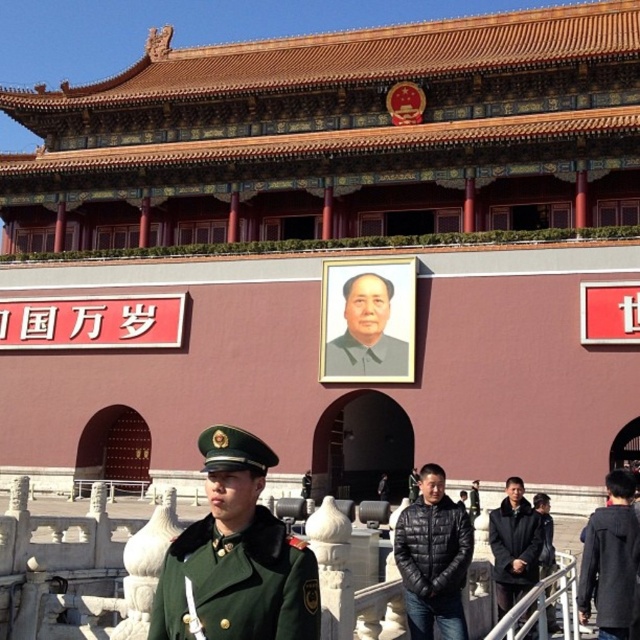
Question: Which object is farther from the camera taking this photo?

Choices:
 (A) green fabric uniform at center
 (B) green fabric uniform at lower right
 (C) black leather jacket at lower right
 (D) smooth gray portrait at center

Answer: (D)

Question: Does black leather jacket at lower right appear on the left side of green fabric uniform at center?

Choices:
 (A) no
 (B) yes

Answer: (A)

Question: Observing the image, what is the correct spatial positioning of green fabric uniform at lower right in reference to black leather jacket at lower right?

Choices:
 (A) above
 (B) below

Answer: (A)

Question: Estimate the real-world distances between objects in this image. Which object is closer to the green fabric uniform at lower right?

Choices:
 (A) green fabric uniform at center
 (B) green woolen coat at lower left
 (C) black leather jacket at lower right

Answer: (C)

Question: Which object is farther from the camera taking this photo?

Choices:
 (A) green woolen coat at lower left
 (B) black leather jacket at lower right
 (C) green woolen uniform at center

Answer: (B)

Question: Is green woolen coat at lower left positioned behind green fabric uniform at center?

Choices:
 (A) no
 (B) yes

Answer: (A)